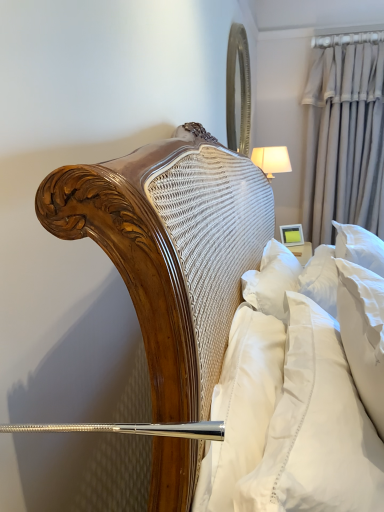
Question: Does white soft pillow at right appear on the left side of matte yellow picture frame at upper right?

Choices:
 (A) yes
 (B) no

Answer: (A)

Question: From a real-world perspective, is white soft pillow at right physically above matte yellow picture frame at upper right?

Choices:
 (A) yes
 (B) no

Answer: (B)

Question: Is matte yellow picture frame at upper right a part of white soft pillow at right?

Choices:
 (A) no
 (B) yes

Answer: (A)

Question: Is white soft pillow at right wider than matte yellow picture frame at upper right?

Choices:
 (A) no
 (B) yes

Answer: (B)

Question: Considering the relative positions of white soft pillow at right and matte yellow picture frame at upper right in the image provided, is white soft pillow at right to the right of matte yellow picture frame at upper right from the viewer's perspective?

Choices:
 (A) yes
 (B) no

Answer: (B)

Question: Is white soft pillow at right shorter than matte yellow picture frame at upper right?

Choices:
 (A) yes
 (B) no

Answer: (B)

Question: Does beige fabric curtain at upper right lie in front of silver/metallic mirror at upper right?

Choices:
 (A) no
 (B) yes

Answer: (A)

Question: Can you confirm if beige fabric curtain at upper right is positioned to the left of silver/metallic mirror at upper right?

Choices:
 (A) yes
 (B) no

Answer: (B)

Question: Could silver/metallic mirror at upper right be considered to be inside beige fabric curtain at upper right?

Choices:
 (A) yes
 (B) no

Answer: (B)

Question: Is beige fabric curtain at upper right not within silver/metallic mirror at upper right?

Choices:
 (A) no
 (B) yes

Answer: (B)

Question: Is beige fabric curtain at upper right looking in the opposite direction of silver/metallic mirror at upper right?

Choices:
 (A) yes
 (B) no

Answer: (B)

Question: Considering the relative sizes of beige fabric curtain at upper right and silver/metallic mirror at upper right in the image provided, is beige fabric curtain at upper right thinner than silver/metallic mirror at upper right?

Choices:
 (A) yes
 (B) no

Answer: (B)

Question: From a real-world perspective, is matte yellow picture frame at upper right located higher than beige fabric curtain at upper right?

Choices:
 (A) yes
 (B) no

Answer: (B)